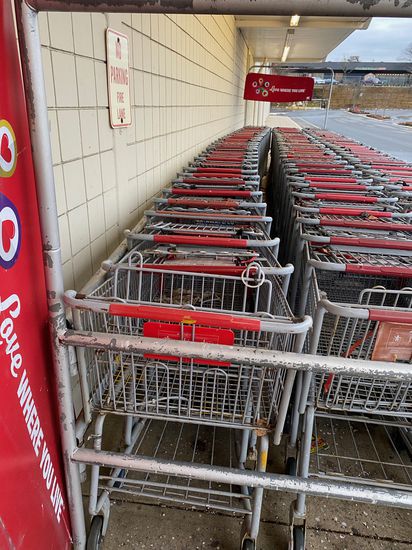
Find the location of a particular element. The width and height of the screenshot is (412, 550). cream wall tiles is located at coordinates (70, 134).